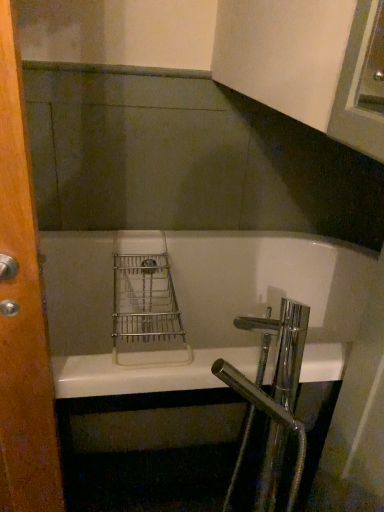
Question: Is chrome/metallic faucet at lower right bigger or smaller than wooden door at left?

Choices:
 (A) small
 (B) big

Answer: (B)

Question: From a real-world perspective, is chrome/metallic faucet at lower right physically located above or below wooden door at left?

Choices:
 (A) below
 (B) above

Answer: (A)

Question: Based on their relative distances, which object is nearer to the white glossy bathtub at center?

Choices:
 (A) wooden door at left
 (B) chrome/metallic faucet at lower right

Answer: (B)

Question: Based on their relative distances, which object is nearer to the chrome/metallic faucet at lower right?

Choices:
 (A) white glossy bathtub at center
 (B) wooden door at left

Answer: (B)